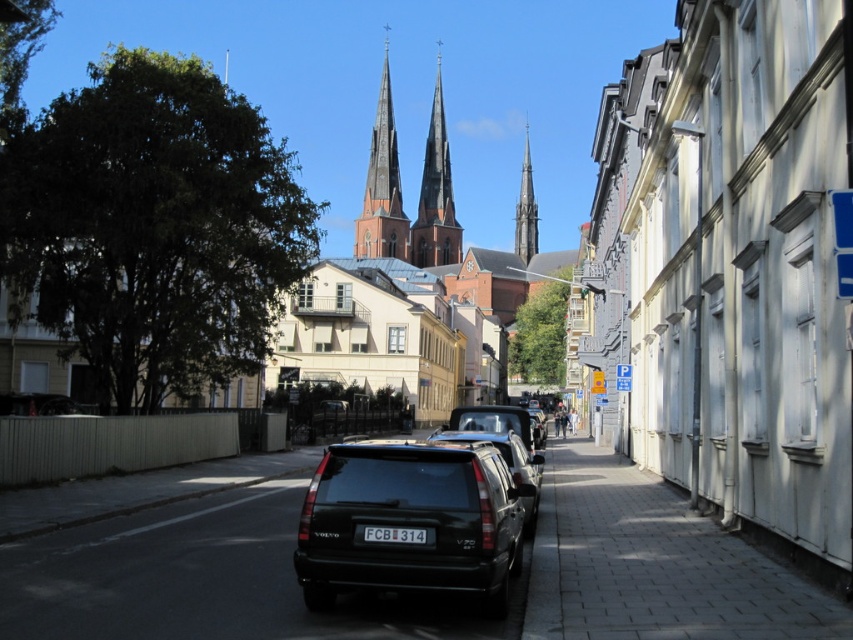
Image resolution: width=853 pixels, height=640 pixels. Describe the element at coordinates (653, 564) in the screenshot. I see `smooth concrete sidewalk at center` at that location.

Is smooth concrete sidewalk at center bigger than blue plastic parking sign at center?

Yes, smooth concrete sidewalk at center is bigger than blue plastic parking sign at center.

Does point (567, 568) lie in front of point (628, 385)?

Yes, point (567, 568) is in front of point (628, 385).

Find the location of `smooth concrete sidewalk at center`. smooth concrete sidewalk at center is located at coordinates (653, 564).

Does smooth red brick tower at center have a larger size compared to blue plastic parking sign at center?

Yes.

Does smooth red brick tower at center appear on the right side of blue plastic parking sign at center?

Incorrect, smooth red brick tower at center is not on the right side of blue plastic parking sign at center.

Is point (436, 108) positioned behind point (625, 376)?

Yes, point (436, 108) is farther from viewer.

The height and width of the screenshot is (640, 853). I want to click on smooth red brick tower at center, so click(434, 195).

Which is in front, point (378, 214) or point (492, 444)?

Point (492, 444)

From the picture: Is smooth stone spire at center bigger than matte black car at center?

Indeed, smooth stone spire at center has a larger size compared to matte black car at center.

Is point (387, 212) closer to camera compared to point (445, 433)?

No.

Find the location of a particular element. Image resolution: width=853 pixels, height=640 pixels. smooth stone spire at center is located at coordinates (381, 182).